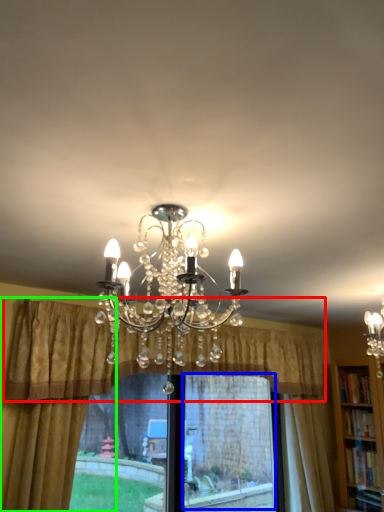
Question: Which object is the closest to the curtain (highlighted by a red box)? Choose among these: window screen (highlighted by a blue box) or curtain (highlighted by a green box).

Choices:
 (A) window screen
 (B) curtain

Answer: (A)